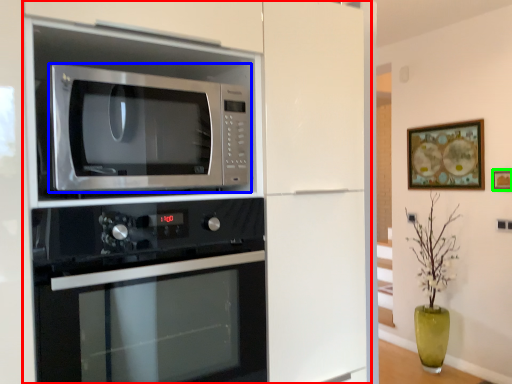
Question: Which is nearer to the cabinetry (highlighted by a red box)? microwave oven (highlighted by a blue box) or picture frame (highlighted by a green box).

Choices:
 (A) microwave oven
 (B) picture frame

Answer: (A)